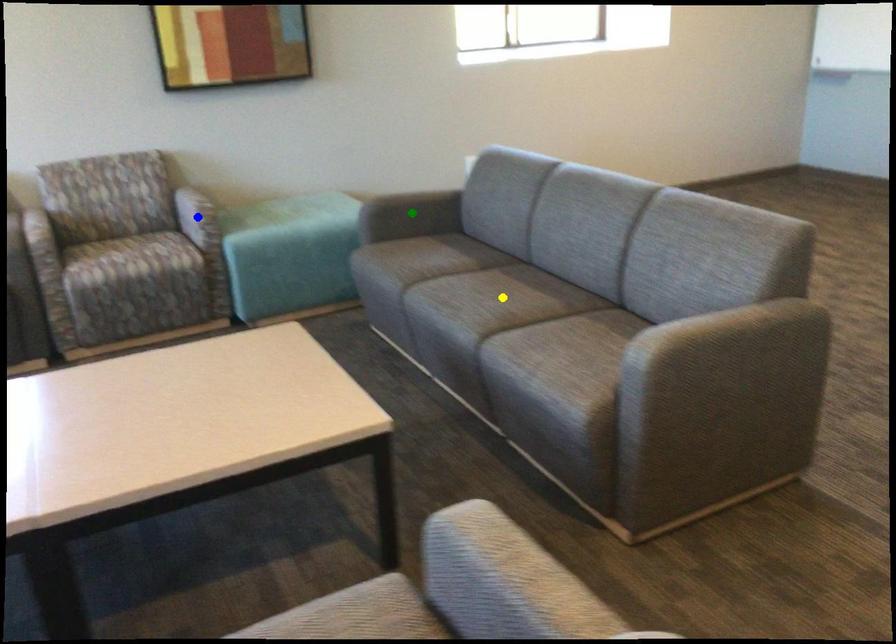
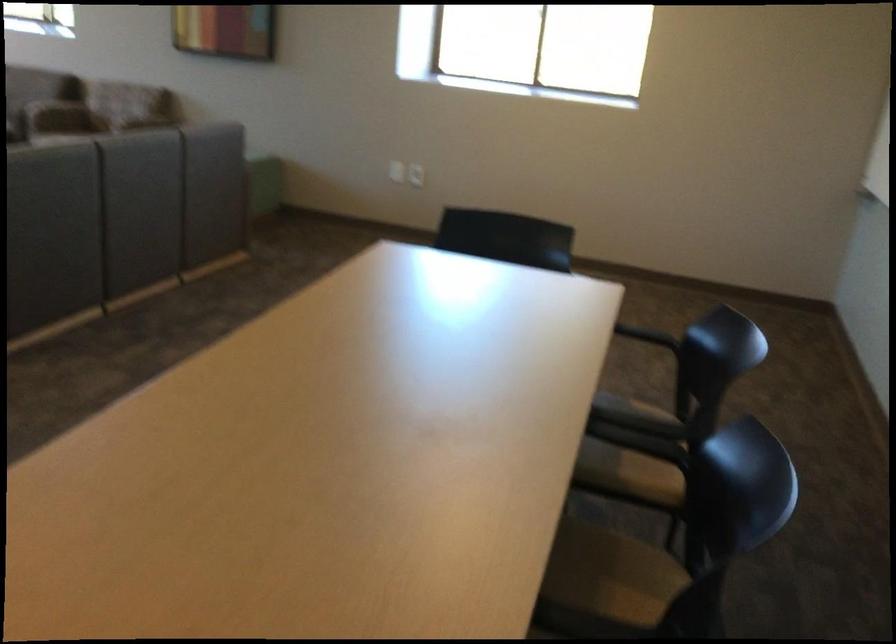
I am providing you with two images of the same scene from different viewpoints. Three points are marked in image1. Which point corresponds to a part or object that is occluded in image2?In image1, three points are marked. Which of them correspond to a part or object that is occluded in image2?Among the three points shown in image1, which one corresponds to a part or object that is no longer visible due to occlusion in image2?

green point, blue point, yellow point cannot be seen in image2.